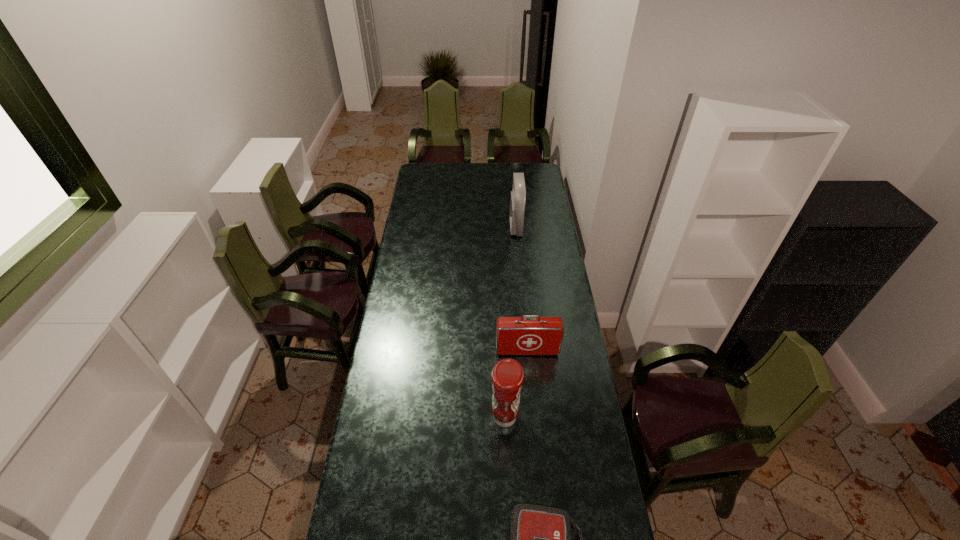
What are the coordinates of `object present at the right edge` in the screenshot? It's located at (522, 335).

Where is `free space at the far edge`? free space at the far edge is located at coordinates (453, 169).

Where is `blank space at the left edge of the desktop`? blank space at the left edge of the desktop is located at coordinates (435, 202).

The height and width of the screenshot is (540, 960). Identify the location of vacant space at the right edge. (560, 454).

I want to click on empty location between the farthest first-aid kit and the third nearest object, so click(521, 289).

At what (x,y) coordinates should I click in order to perform the action: click on free space between the tallest first-aid kit and the third nearest object. Please return your answer as a coordinate pair (x, y). Looking at the image, I should click on (521, 289).

I want to click on the third closest object to the farthest first-aid kit, so click(540, 537).

At what (x,y) coordinates should I click in order to perform the action: click on object that can be found as the third closest to the second nearest object. Please return your answer as a coordinate pair (x, y). Looking at the image, I should click on (518, 196).

Locate an element on the screen. The height and width of the screenshot is (540, 960). the first-aid kit that is the second closest to the nearest object is located at coordinates (518, 196).

Identify which first-aid kit is the second closest to the shortest object. Please provide its 2D coordinates. Your answer should be formatted as a tuple, i.e. [(x, y)], where the tuple contains the x and y coordinates of a point satisfying the conditions above.

[(518, 196)]